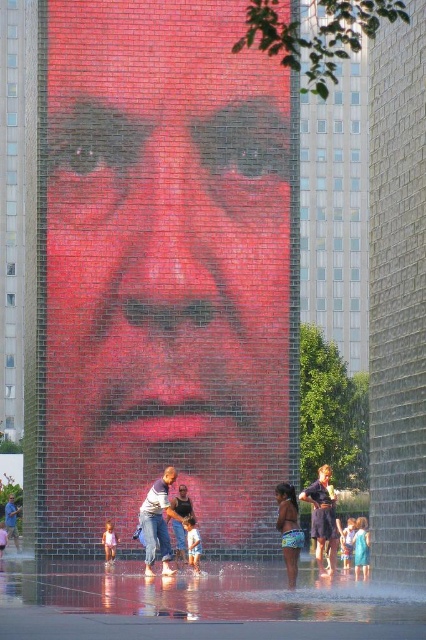
You are a photographer standing at the edge of the water feature. You want to capture a photo of the denim jeans at center without any water jets in the foreground. Based on the coordinates provided, can you position yourself in such a way to achieve this?

The denim jeans at center is located at coordinates point [158,522]. Since the water jets are arranged in a grid pattern at the base of the display, positioning yourself slightly to the side of the jeans might allow you to avoid the water jets in the foreground. However, precise adjustments would be needed to ensure the jets don not obstruct the view.

From the picture: You are standing in front of the water feature and want to reach the point marked as point (414,586). However, there is an obstacle at point (109,531). Which point should you avoid to reach your destination safely?

You should avoid the obstacle at point (109,531) because it is farther from you than the destination point (414,586), so navigating around it would be safer.

You are a photographer standing in front of the water feature. You want to take a photo of the pink fabric dress at center and the clear glass water at lower center. Which object should you focus on first if you want to capture both in sharp focus?

The clear glass water at lower center is much taller than the pink fabric dress at center, so you should focus on the clear glass water at lower center first to ensure both are in sharp focus.